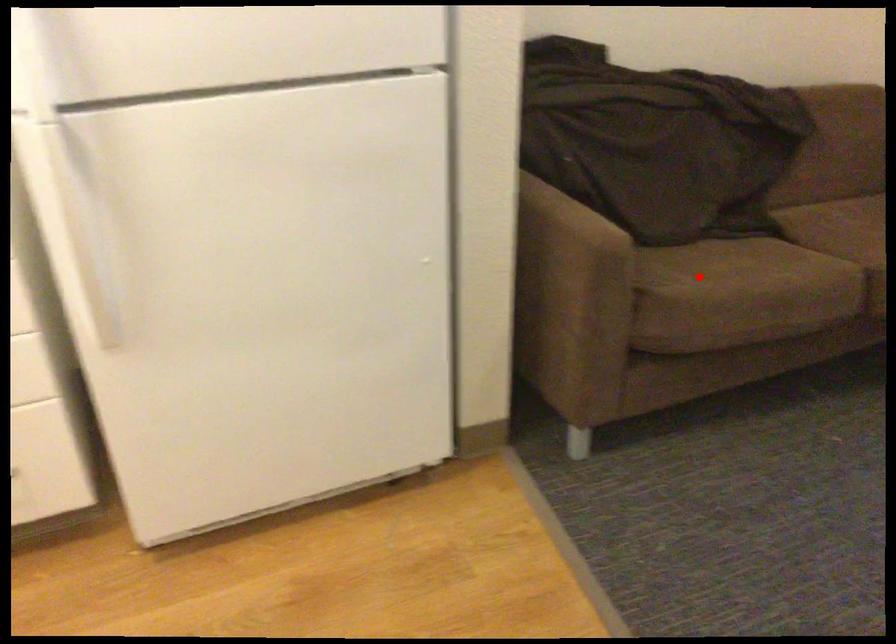
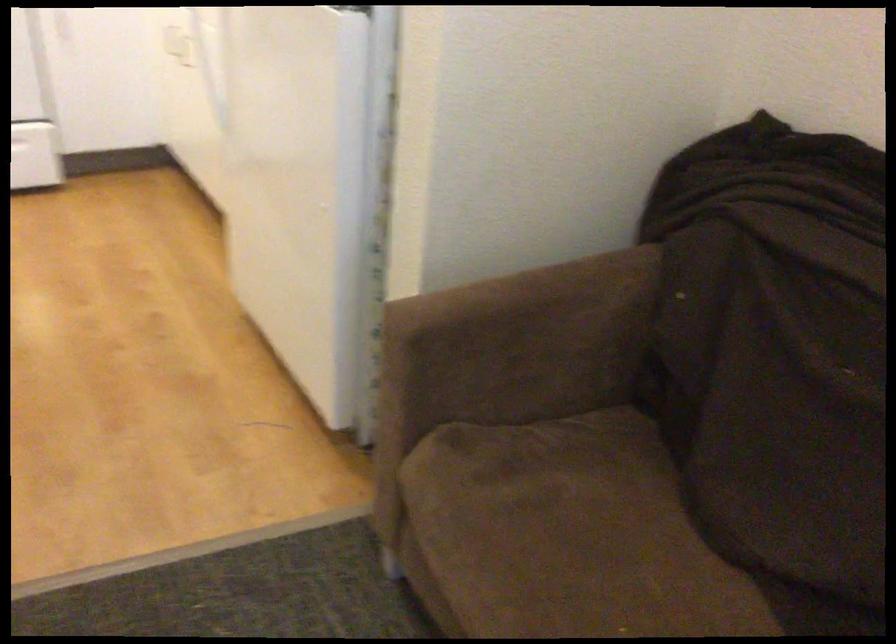
Question: I am providing you with two images of the same scene from different viewpoints. Given a red point in image1, look at the same physical point in image2. Is it:

Choices:
 (A) Closer to the viewpoint
 (B) Farther from the viewpoint

Answer: (A)